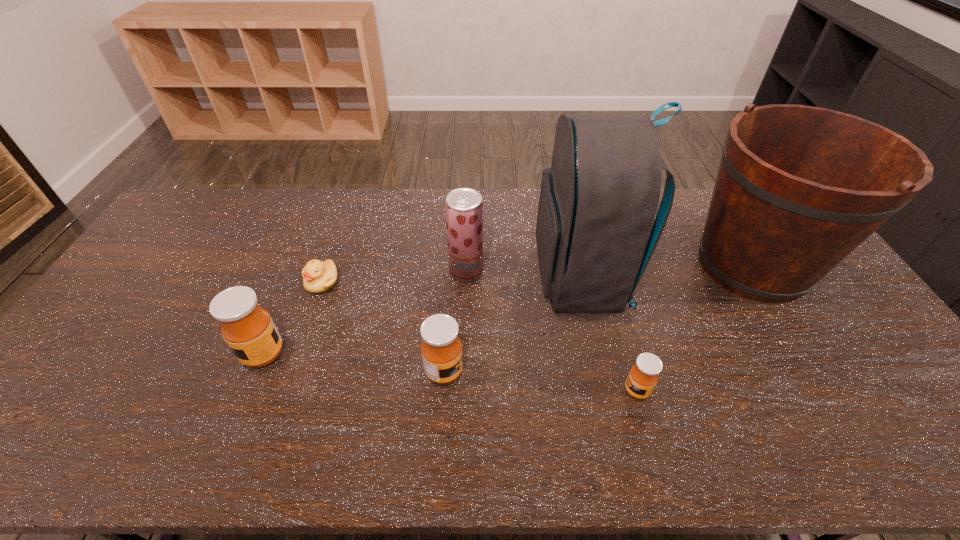
Where is `object that is the third nearest to the leftmost honey`? object that is the third nearest to the leftmost honey is located at coordinates (464, 207).

Select which object is the fourth closest to the leftmost honey. Please provide its 2D coordinates. Your answer should be formatted as a tuple, i.e. [(x, y)], where the tuple contains the x and y coordinates of a point satisfying the conditions above.

[(598, 201)]

At what (x,y) coordinates should I click in order to perform the action: click on the second closest honey to the shortest object. Please return your answer as a coordinate pair (x, y). Image resolution: width=960 pixels, height=540 pixels. Looking at the image, I should click on (441, 348).

Locate which honey is the closest to the fruit juice. Please provide its 2D coordinates. Your answer should be formatted as a tuple, i.e. [(x, y)], where the tuple contains the x and y coordinates of a point satisfying the conditions above.

[(441, 348)]

Identify the location of free point that satisfies the following two spatial constraints: 1. on the beak of the shortest object; 2. on the front-facing side of the leftmost honey. Image resolution: width=960 pixels, height=540 pixels. (298, 354).

Find the location of a particular element. The image size is (960, 540). vacant point that satisfies the following two spatial constraints: 1. on the front-facing side of the backpack; 2. on the beak of the shortest object is located at coordinates (581, 282).

At what (x,y) coordinates should I click in order to perform the action: click on blank area in the image that satisfies the following two spatial constraints: 1. on the beak of the duckling; 2. on the front-facing side of the leftmost honey. Please return your answer as a coordinate pair (x, y). This screenshot has height=540, width=960. Looking at the image, I should click on (298, 354).